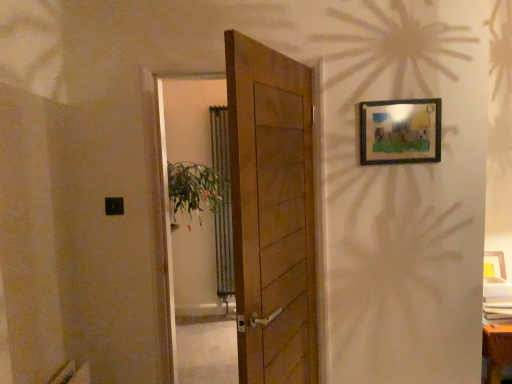
Question: Is wooden door at center beside wooden picture frame at upper right?

Choices:
 (A) yes
 (B) no

Answer: (B)

Question: From a real-world perspective, is wooden door at center located beneath wooden picture frame at upper right?

Choices:
 (A) no
 (B) yes

Answer: (B)

Question: Can we say wooden door at center lies outside wooden picture frame at upper right?

Choices:
 (A) yes
 (B) no

Answer: (A)

Question: Can you confirm if wooden door at center is taller than wooden picture frame at upper right?

Choices:
 (A) yes
 (B) no

Answer: (A)

Question: From the image's perspective, does wooden door at center appear higher than wooden picture frame at upper right?

Choices:
 (A) no
 (B) yes

Answer: (A)

Question: From a real-world perspective, is wooden door at center above or below wooden door at center?

Choices:
 (A) below
 (B) above

Answer: (B)

Question: Is point (168, 309) positioned closer to the camera than point (259, 165)?

Choices:
 (A) farther
 (B) closer

Answer: (A)

Question: From the image's perspective, is wooden door at center located above or below wooden door at center?

Choices:
 (A) above
 (B) below

Answer: (A)

Question: In terms of size, does wooden door at center appear bigger or smaller than wooden door at center?

Choices:
 (A) small
 (B) big

Answer: (A)

Question: In terms of width, does wooden picture frame at upper right look wider or thinner when compared to wooden door at center?

Choices:
 (A) thin
 (B) wide

Answer: (A)

Question: From a real-world perspective, is wooden picture frame at upper right positioned above or below wooden door at center?

Choices:
 (A) above
 (B) below

Answer: (A)

Question: Considering their positions, is wooden picture frame at upper right located in front of or behind wooden door at center?

Choices:
 (A) front
 (B) behind

Answer: (A)

Question: Does point (396, 127) appear closer or farther from the camera than point (207, 312)?

Choices:
 (A) farther
 (B) closer

Answer: (B)

Question: In the image, is wooden door at center on the left side or the right side of wooden door at center?

Choices:
 (A) right
 (B) left

Answer: (A)

Question: Is point [248, 251] positioned closer to the camera than point [209, 306]?

Choices:
 (A) closer
 (B) farther

Answer: (A)